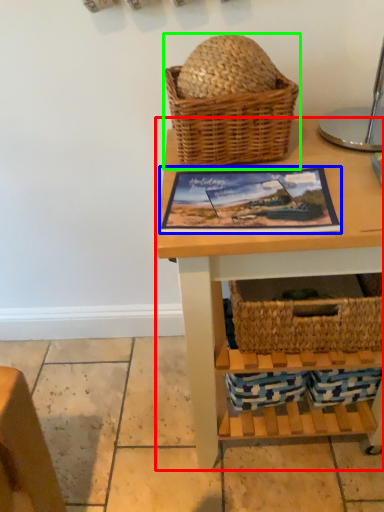
Question: Estimate the real-world distances between objects in this image. Which object is closer to table (highlighted by a red box), picture frame (highlighted by a blue box) or picnic basket (highlighted by a green box)?

Choices:
 (A) picture frame
 (B) picnic basket

Answer: (A)